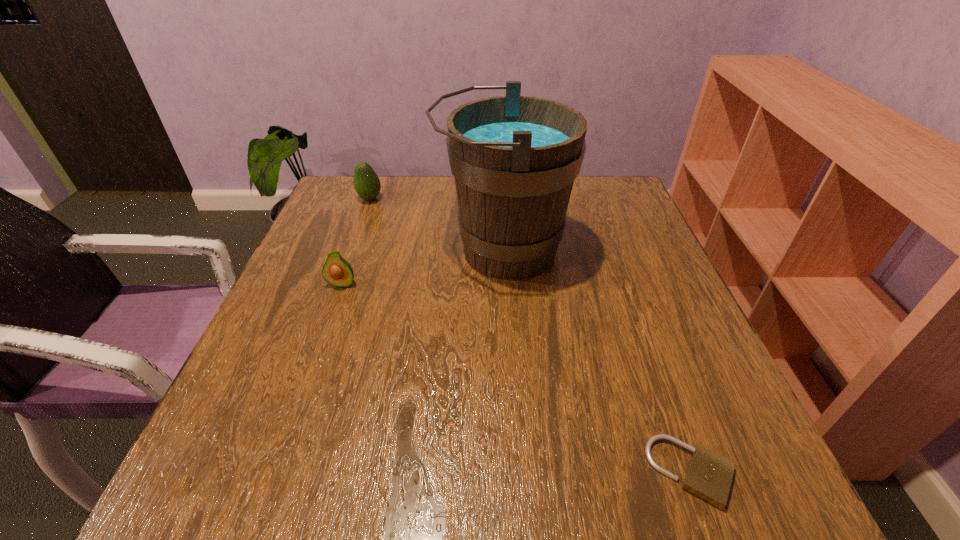
Locate an element on the screen. This screenshot has height=540, width=960. the second object from right to left is located at coordinates (514, 158).

Find the location of a particular element. This screenshot has width=960, height=540. wine bucket is located at coordinates (514, 158).

I want to click on the farther avocado, so click(x=367, y=185).

The image size is (960, 540). What are the coordinates of `the nearer avocado` in the screenshot? It's located at (336, 271).

At what (x,y) coordinates should I click in order to perform the action: click on the shortest object. Please return your answer as a coordinate pair (x, y). Looking at the image, I should click on (709, 475).

You are a GUI agent. You are given a task and a screenshot of the screen. Output one action in this format:
    pyautogui.click(x=<x>, y=<y>)
    Task: Click on the rightmost object
    
    Given the screenshot: What is the action you would take?
    pyautogui.click(x=709, y=475)

Image resolution: width=960 pixels, height=540 pixels. I want to click on blank area located 0.050m with a handle on the side of the second object from right to left, so click(415, 251).

This screenshot has width=960, height=540. In order to click on vacant space positioned 0.290m with a handle on the side of the second object from right to left in this screenshot , I will do `click(310, 251)`.

Where is `vacant area situated 0.110m with a handle on the side of the second object from right to left`? vacant area situated 0.110m with a handle on the side of the second object from right to left is located at coordinates (389, 251).

Find the location of a particular element. blank space located 0.230m on the front of the farthest object is located at coordinates (348, 261).